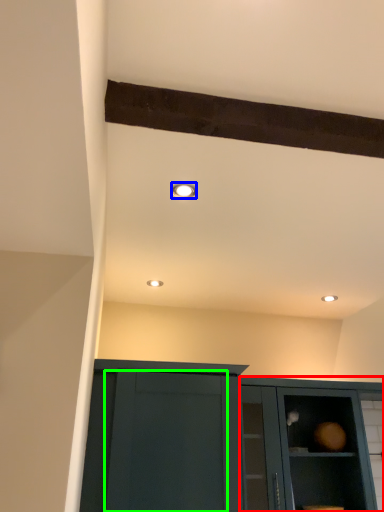
Question: Based on their relative distances, which object is nearer to cabinetry (highlighted by a red box)? Choose from lighting (highlighted by a blue box) and glass door (highlighted by a green box).

Choices:
 (A) lighting
 (B) glass door

Answer: (B)